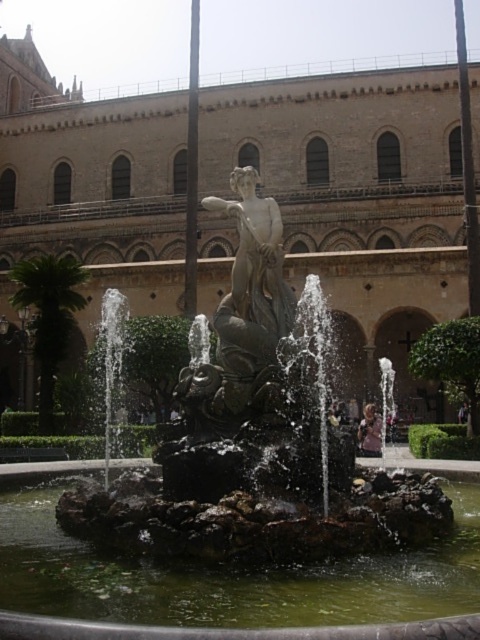
Can you confirm if brick stone palace at center is smaller than matte bronze statue at center?

No, brick stone palace at center is not smaller than matte bronze statue at center.

Which is in front, point (228, 148) or point (236, 360)?

Point (236, 360) is in front.

Does point (91, 284) come closer to viewer compared to point (265, 221)?

No, it is not.

Where is `brick stone palace at center`? This screenshot has height=640, width=480. brick stone palace at center is located at coordinates 358,196.

Is point (478, 160) more distant than point (389, 508)?

Yes, it is.

Which is below, brick stone palace at center or bronze statue at center?

bronze statue at center is below.

Between point (289, 189) and point (240, 444), which one is positioned in front?

Point (240, 444) is more forward.

Find the location of `brick stone palace at center`. brick stone palace at center is located at coordinates (358, 196).

Who is more distant from viewer, (82, 259) or (189, 616)?

The point (82, 259) is more distant.

Looking at this image, can you confirm if brick stone palace at center is positioned below green stone water at center?

Actually, brick stone palace at center is above green stone water at center.

Image resolution: width=480 pixels, height=640 pixels. Find the location of `brick stone palace at center`. brick stone palace at center is located at coordinates (358, 196).